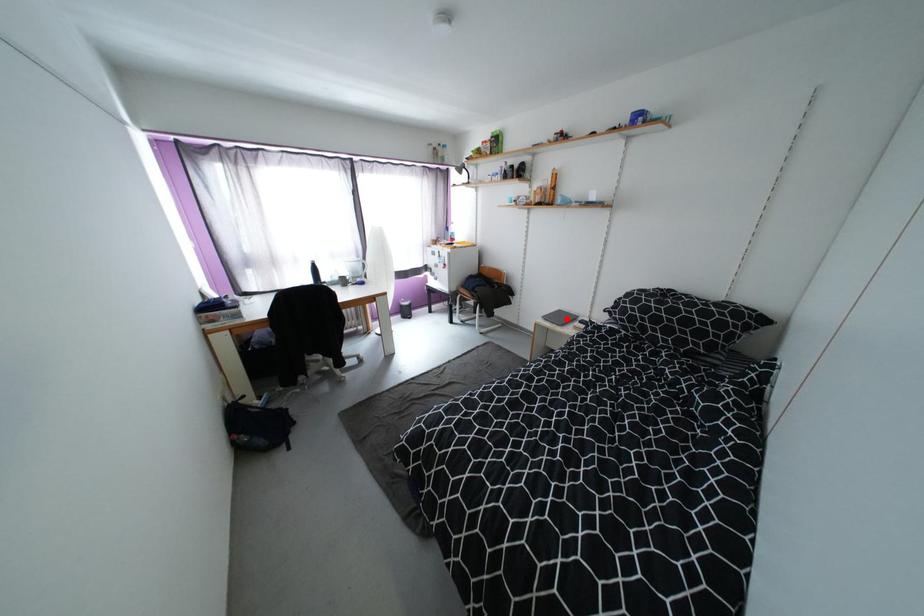
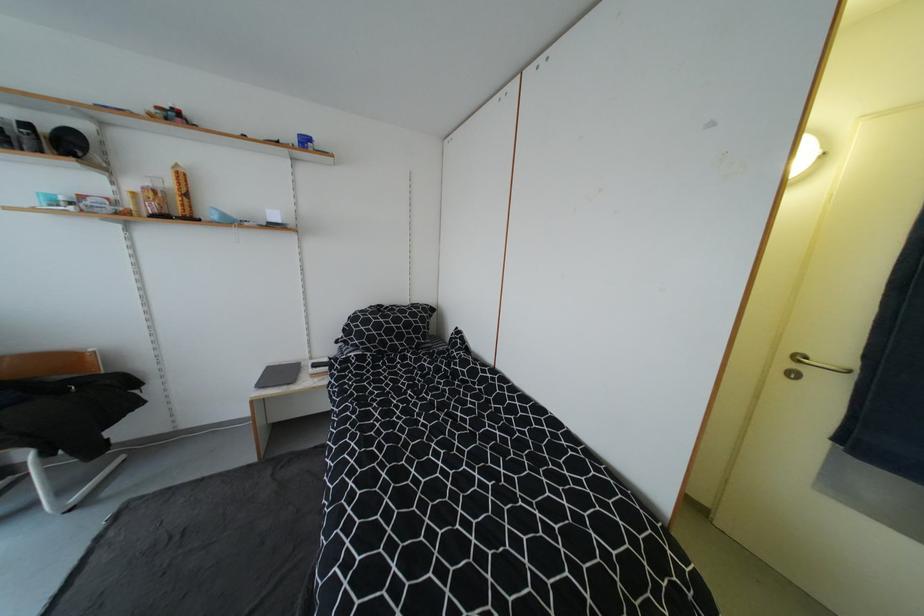
Question: I am providing you with two images of the same scene from different viewpoints. A red point is marked on the first image. Is the red point's position out of view in image 2?

Choices:
 (A) Yes
 (B) No

Answer: (B)